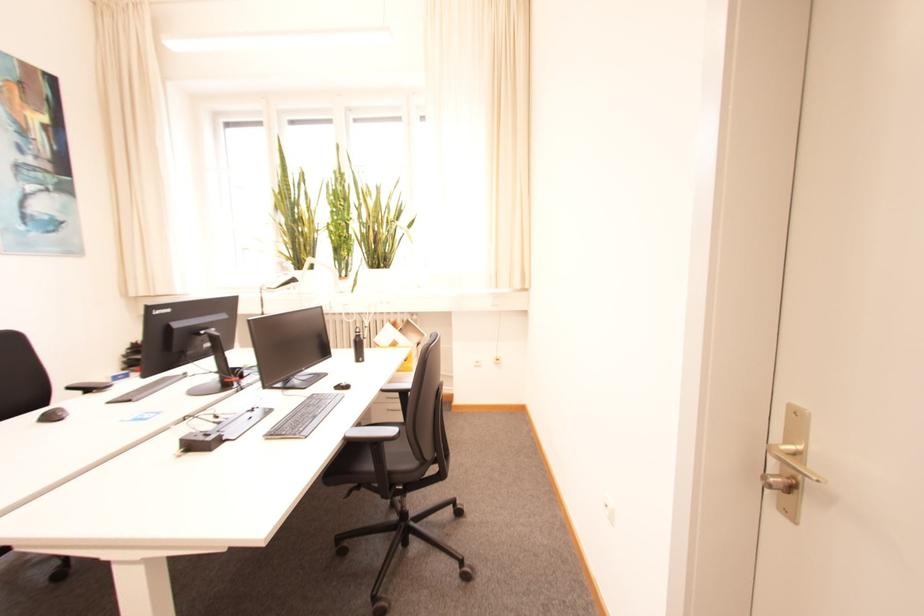
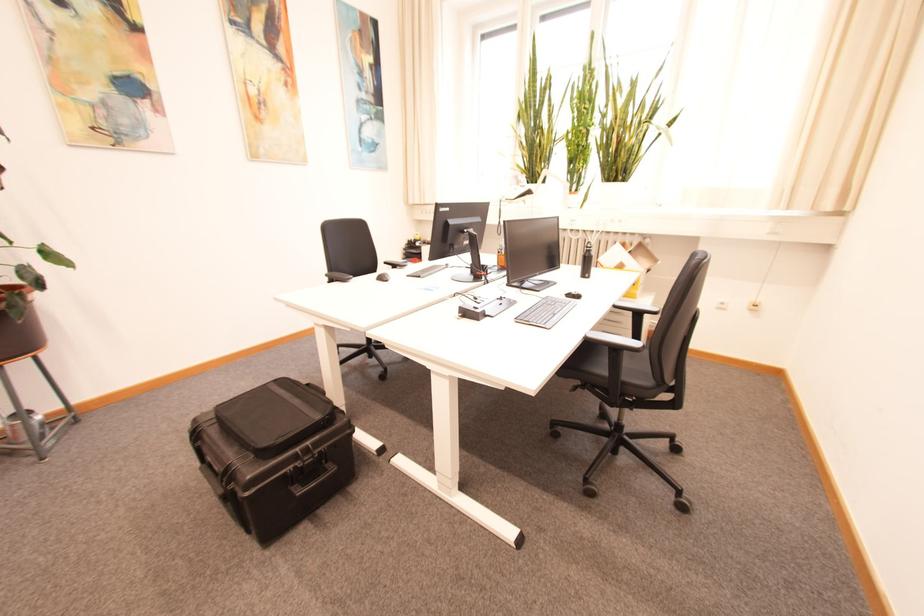
Find the pixel in the second image that matches [397,467] in the first image.

(631, 377)